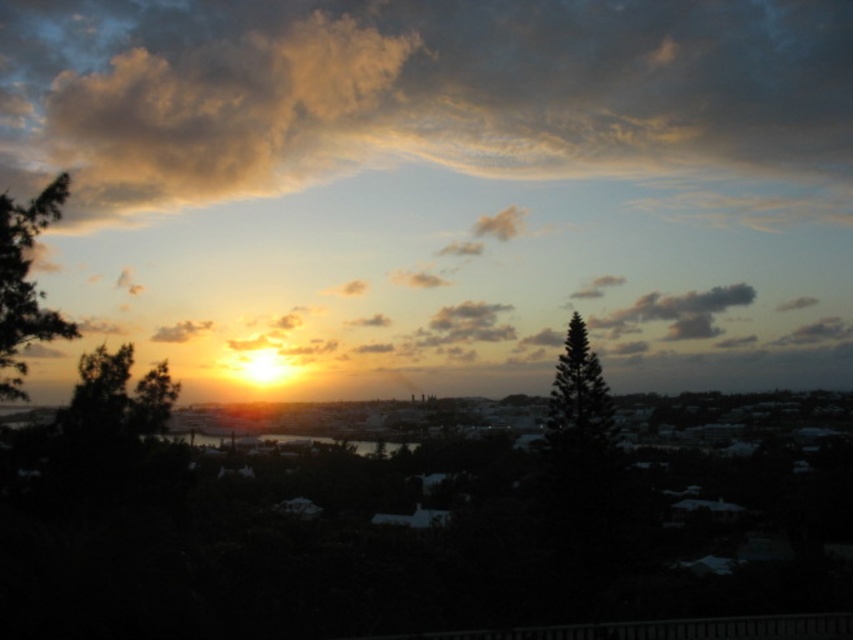
Question: Based on their relative distances, which object is farther from the golden cotton cloud at upper center?

Choices:
 (A) green leafy tree at left
 (B) golden textured cloud at upper left
 (C) green leafy tree at center
 (D) green textured pine tree at center

Answer: (A)

Question: Estimate the real-world distances between objects in this image. Which object is closer to the green leafy tree at center?

Choices:
 (A) golden textured cloud at upper left
 (B) golden cotton cloud at upper center
 (C) green textured pine tree at center
 (D) green leafy tree at left

Answer: (D)

Question: Can you confirm if golden cotton cloud at upper center is positioned above green leafy tree at left?

Choices:
 (A) no
 (B) yes

Answer: (B)

Question: In this image, where is golden cotton cloud at upper center located relative to green textured pine tree at center?

Choices:
 (A) right
 (B) left

Answer: (A)

Question: Which point is closer to the camera?

Choices:
 (A) green leafy tree at center
 (B) green leafy tree at left

Answer: (B)

Question: Is green leafy tree at left positioned behind green leafy tree at center?

Choices:
 (A) no
 (B) yes

Answer: (A)